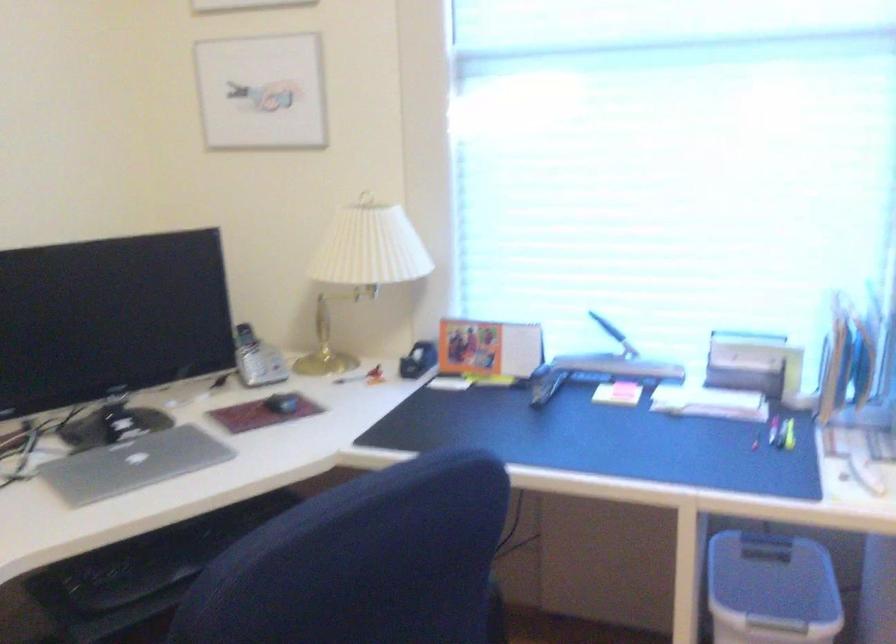
Locate an element on the screen. This screenshot has width=896, height=644. stapler handle is located at coordinates (607, 327).